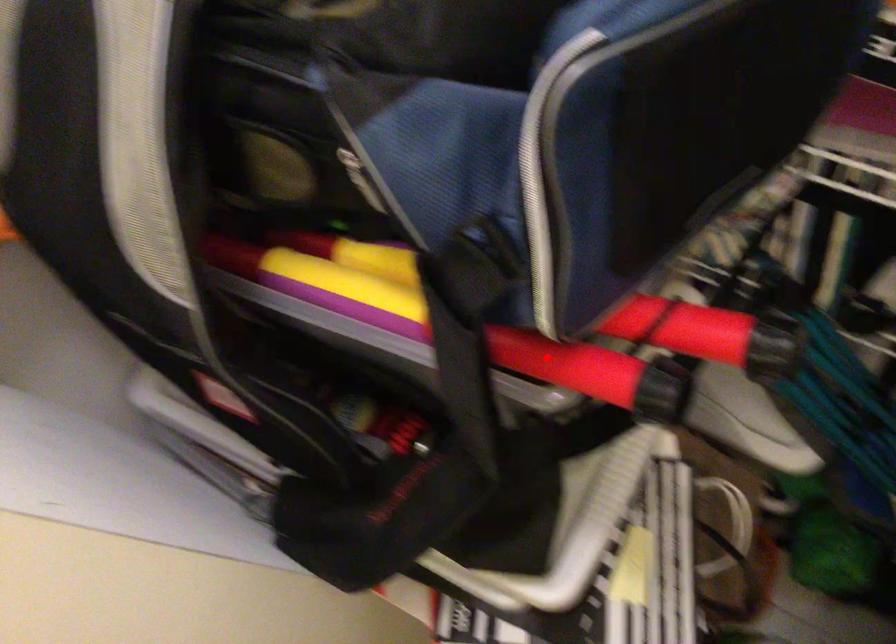
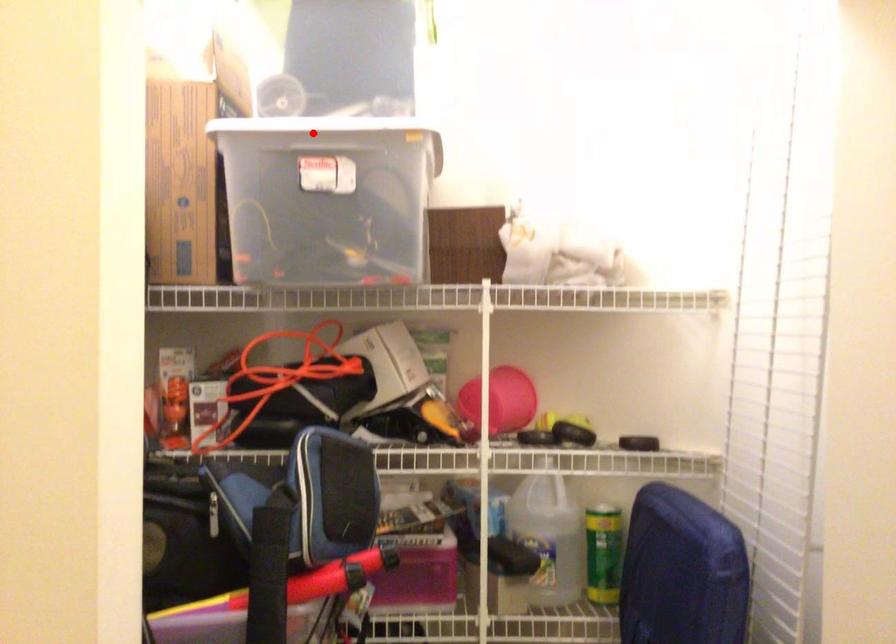
I am providing you with two images of the same scene from different viewpoints. A red point is marked on the first image and another point is marked on the second image. Are the points marked in image1 and image2 representing the same 3D position?

No